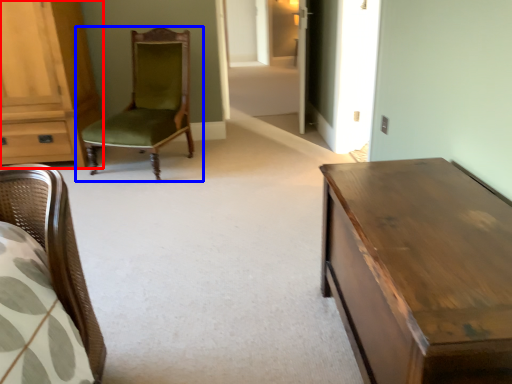
Question: Among these objects, which one is nearest to the camera, cabinetry (highlighted by a red box) or chair (highlighted by a blue box)?

Choices:
 (A) cabinetry
 (B) chair

Answer: (B)